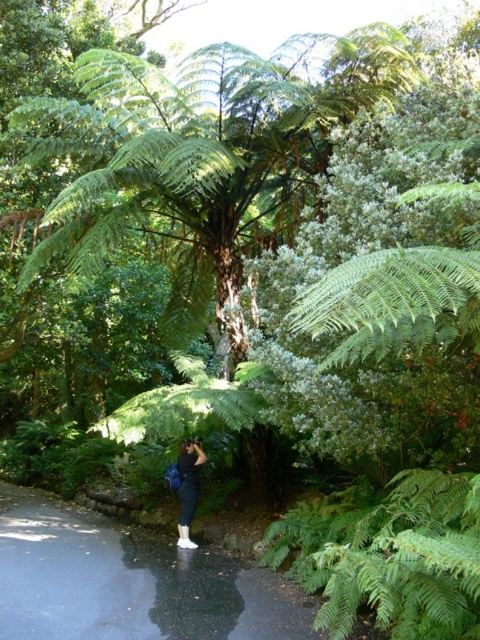
This screenshot has width=480, height=640. Describe the element at coordinates (130, 580) in the screenshot. I see `shiny asphalt path at center` at that location.

Does shiny asphalt path at center appear under denim pants at lower center?

A: Correct, shiny asphalt path at center is located below denim pants at lower center.

Image resolution: width=480 pixels, height=640 pixels. Find the location of `shiny asphalt path at center`. shiny asphalt path at center is located at coordinates (130, 580).

Is green leafy fern at lower right positioned in front of denim pants at lower center?

Yes, green leafy fern at lower right is closer to the viewer.

The height and width of the screenshot is (640, 480). What are the coordinates of `green leafy fern at lower right` in the screenshot? It's located at (391, 556).

Which is in front, point (416, 573) or point (189, 440)?

Positioned in front is point (416, 573).

Locate an element on the screen. green leafy fern at lower right is located at coordinates (391, 556).

Is point (16, 506) farther from viewer compared to point (478, 616)?

Yes, point (16, 506) is farther from viewer.

Can you confirm if shiny asphalt path at center is bigger than green leafy fern at lower right?

No, shiny asphalt path at center is not bigger than green leafy fern at lower right.

Is point (76, 538) behind point (351, 580)?

Yes, it is.

Locate an element on the screen. shiny asphalt path at center is located at coordinates (130, 580).